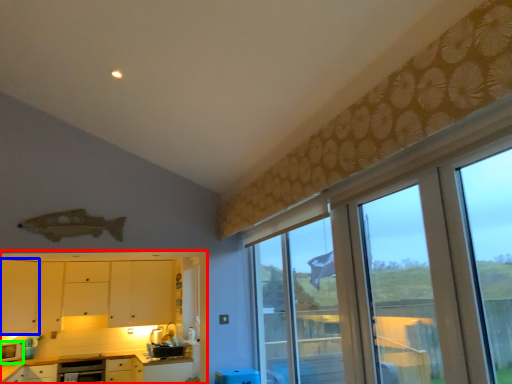
Question: Which object is the farthest from cabinetry (highlighted by a red box)? Choose among these: cabinetry (highlighted by a blue box) or appliance (highlighted by a green box).

Choices:
 (A) cabinetry
 (B) appliance

Answer: (B)